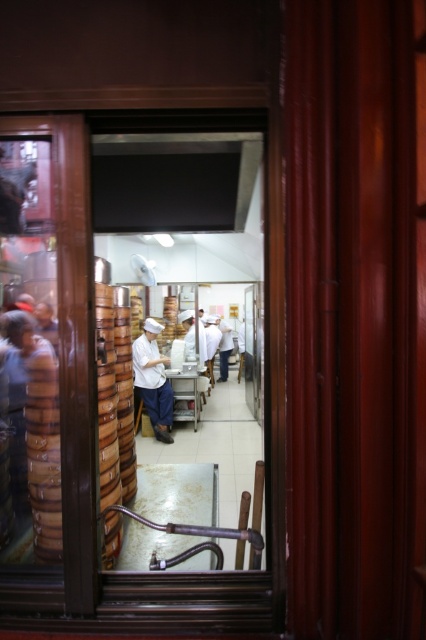
Question: Is transparent glass window at center positioned at the back of white uniform at center?

Choices:
 (A) yes
 (B) no

Answer: (B)

Question: Is transparent glass window at center above white uniform at center?

Choices:
 (A) no
 (B) yes

Answer: (B)

Question: Among these points, which one is nearest to the camera?

Choices:
 (A) (149, 401)
 (B) (52, 294)

Answer: (B)

Question: Is transparent glass window at center wider than white uniform at center?

Choices:
 (A) no
 (B) yes

Answer: (B)

Question: Which point is closer to the camera taking this photo?

Choices:
 (A) (157, 356)
 (B) (135, 620)

Answer: (B)